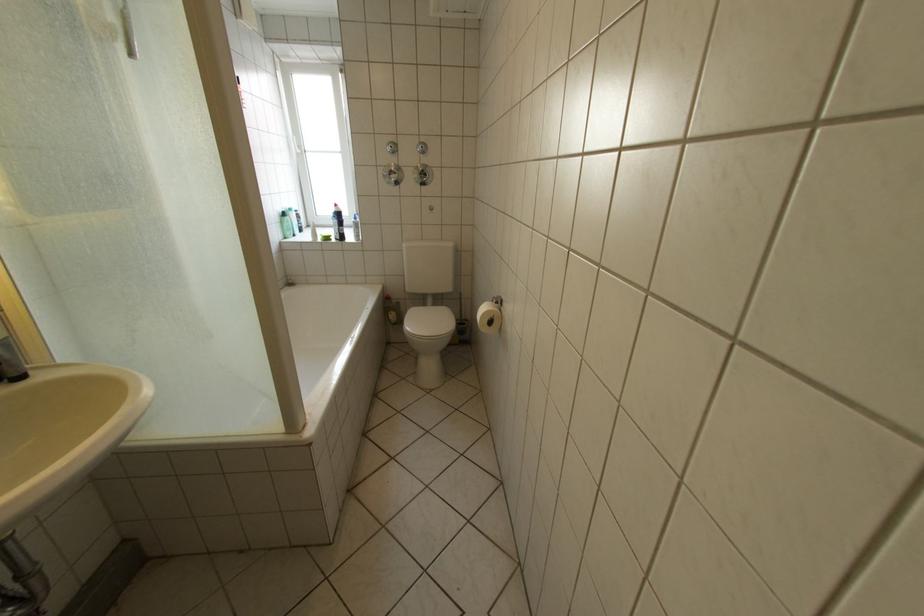
Describe the element at coordinates (392, 310) in the screenshot. This screenshot has height=616, width=924. I see `a toilet brush handle` at that location.